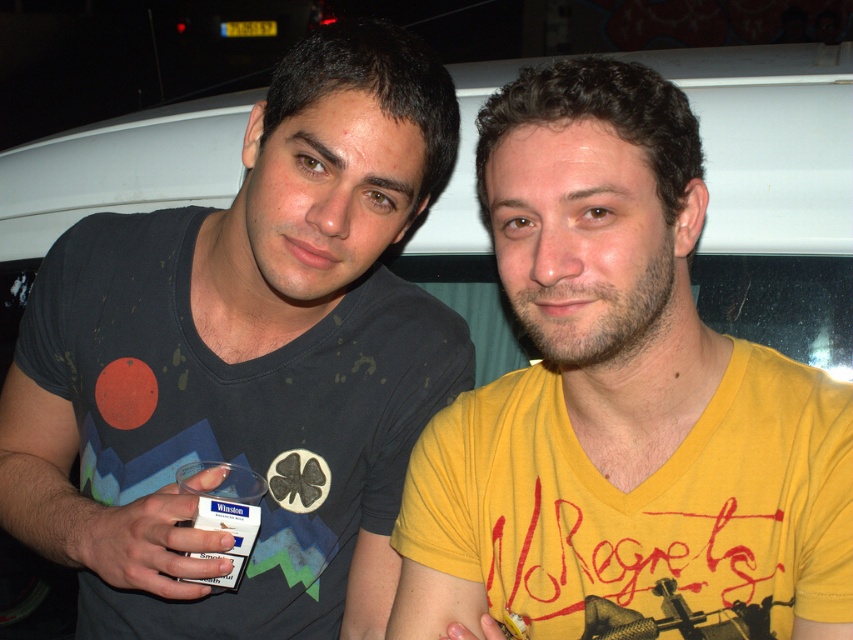
You are standing 1 meter away from the image. If you want to reach the point at coordinates point (347, 246), will you be able to touch it without moving closer?

The distance of point (347, 246) from viewer is 1.12 meters, so you are currently 1 meter away and would need to move 0.12 meters closer to touch it.

You are standing in the center of the image and want to place a sticker at point (x=247, y=362). Which object should you place it on?

The point (x=247, y=362) is on dark gray t shirt at center, so you should place the sticker on the dark gray t shirt at center.